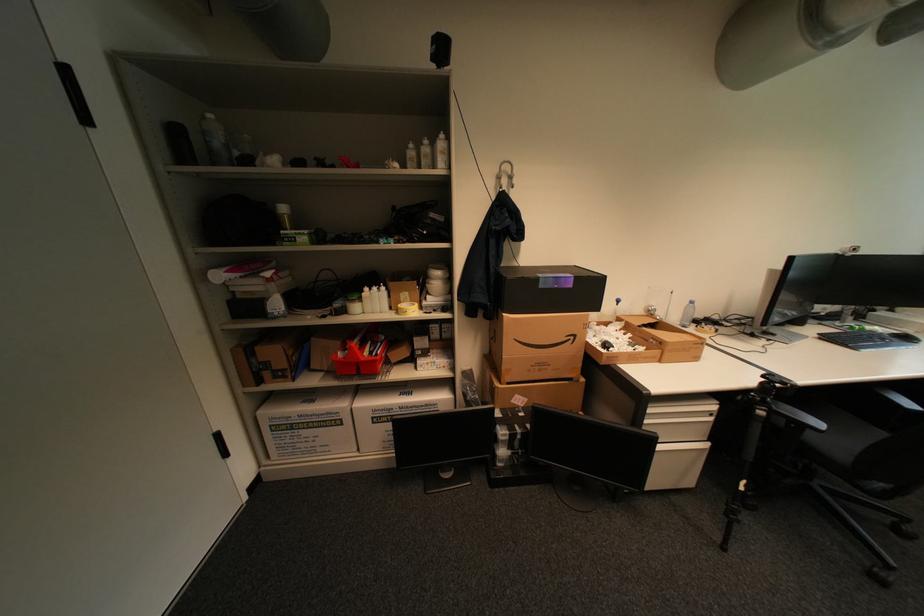
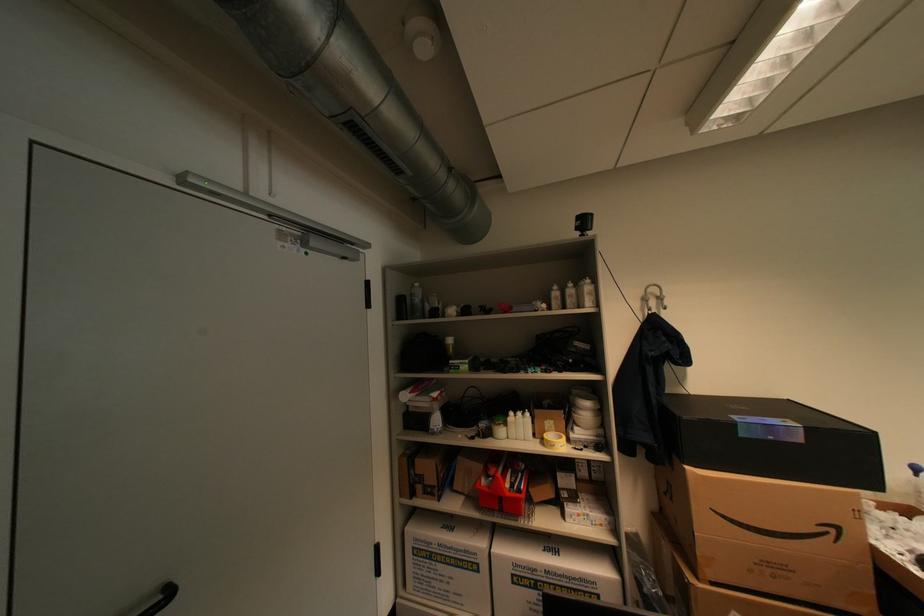
The point at [580,338] is marked in the first image. Where is the corresponding point in the second image?

(841, 531)